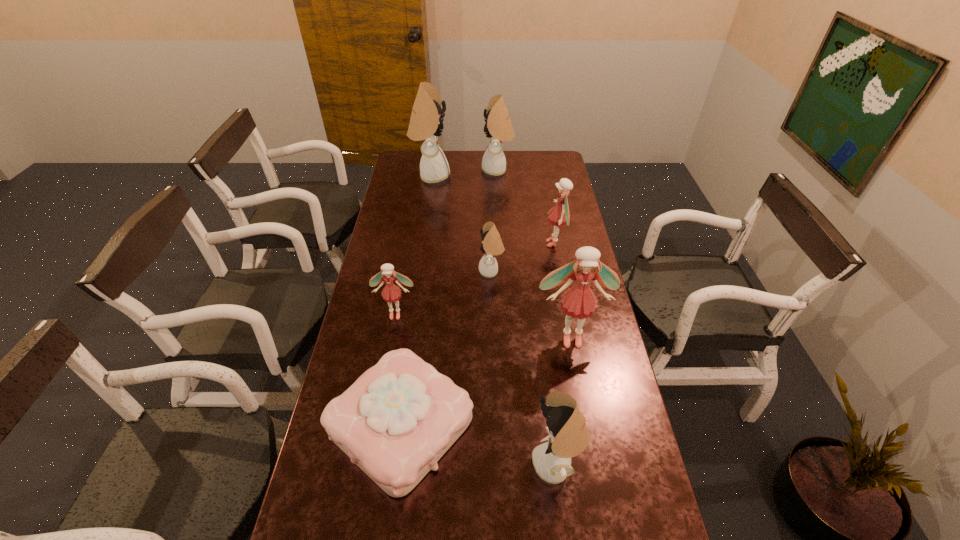
You are a GUI agent. You are given a task and a screenshot of the screen. Output one action in this format:
    pyautogui.click(x=<x>, y=<y>)
    Task: Click on the fifth farthest object
    The width and height of the screenshot is (960, 540).
    Given the screenshot: What is the action you would take?
    pyautogui.click(x=391, y=293)

In order to click on the shortest object in this screenshot , I will do `click(395, 422)`.

This screenshot has height=540, width=960. In order to click on cake in this screenshot , I will do `click(395, 422)`.

Image resolution: width=960 pixels, height=540 pixels. I want to click on free space located at the front face of the leftmost black doll, so click(508, 176).

This screenshot has width=960, height=540. What are the coordinates of `vacant area situated 0.130m at the front face of the second biggest black doll` in the screenshot? It's located at (455, 170).

I want to click on vacant space situated 0.360m at the front face of the second biggest black doll, so click(410, 170).

At what (x,y) coordinates should I click in order to perform the action: click on blank space located 0.130m at the front face of the second biggest black doll. Please return your answer as a coordinate pair (x, y). The image size is (960, 540). Looking at the image, I should click on (455, 170).

Locate an element on the screen. blank space located on the front-facing side of the biggest pink doll is located at coordinates (577, 370).

Where is `free space located 0.060m on the front-facing side of the farthest pink doll`? free space located 0.060m on the front-facing side of the farthest pink doll is located at coordinates (529, 244).

Where is `free location located 0.370m on the front-facing side of the farthest pink doll`? The image size is (960, 540). free location located 0.370m on the front-facing side of the farthest pink doll is located at coordinates (453, 244).